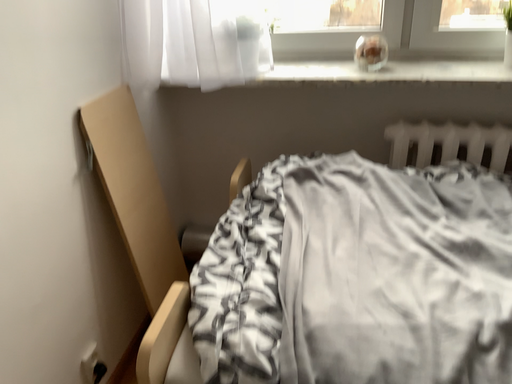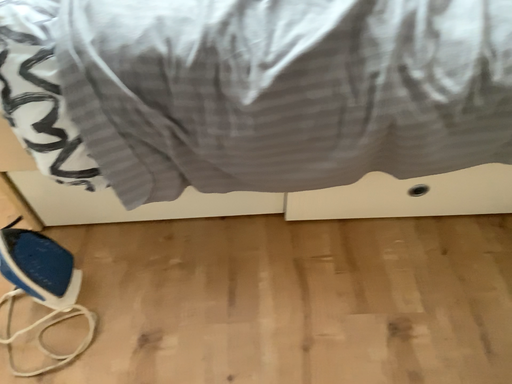
Question: Which way did the camera rotate in the video?

Choices:
 (A) rotated downward
 (B) rotated upward

Answer: (A)